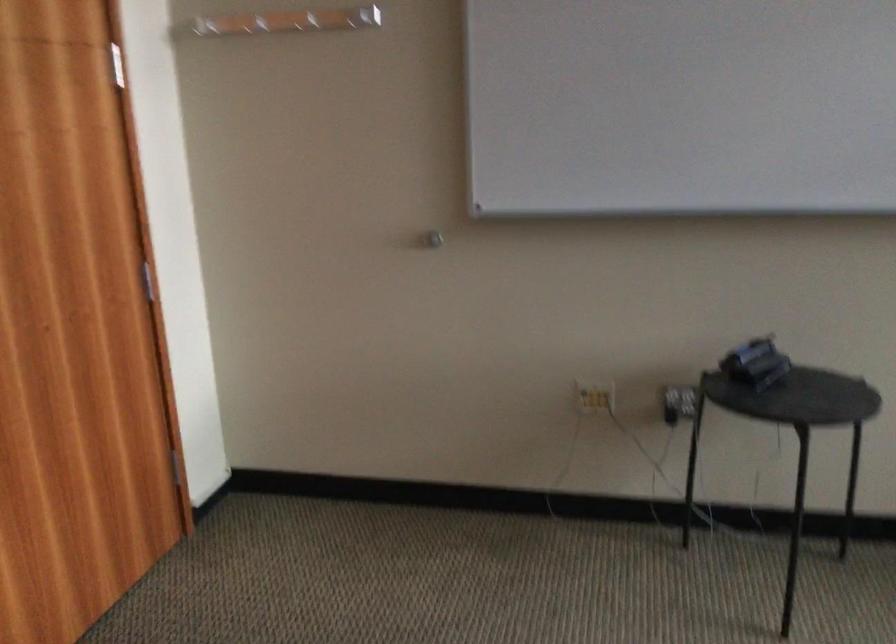
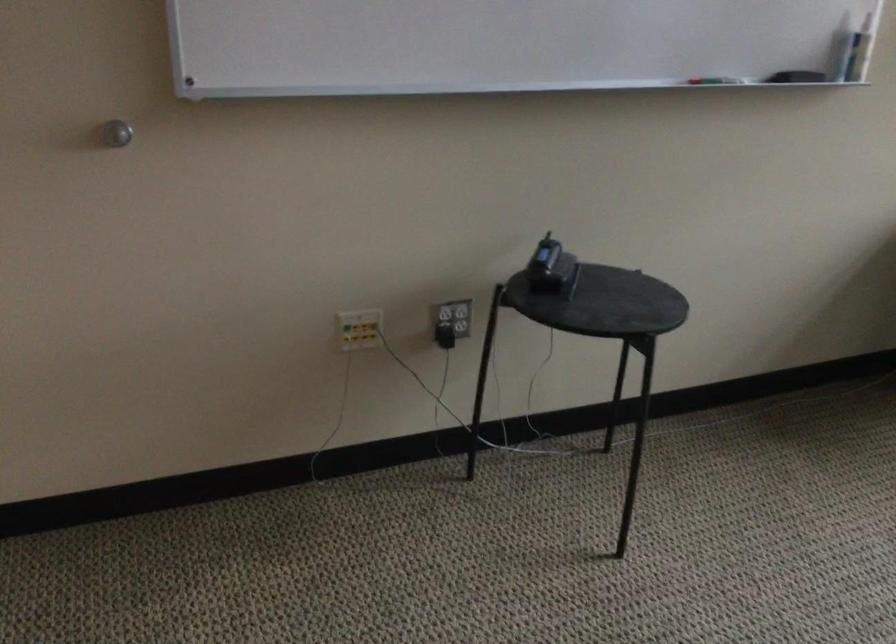
In the second image, find the point that corresponds to [421,234] in the first image.

(116, 133)